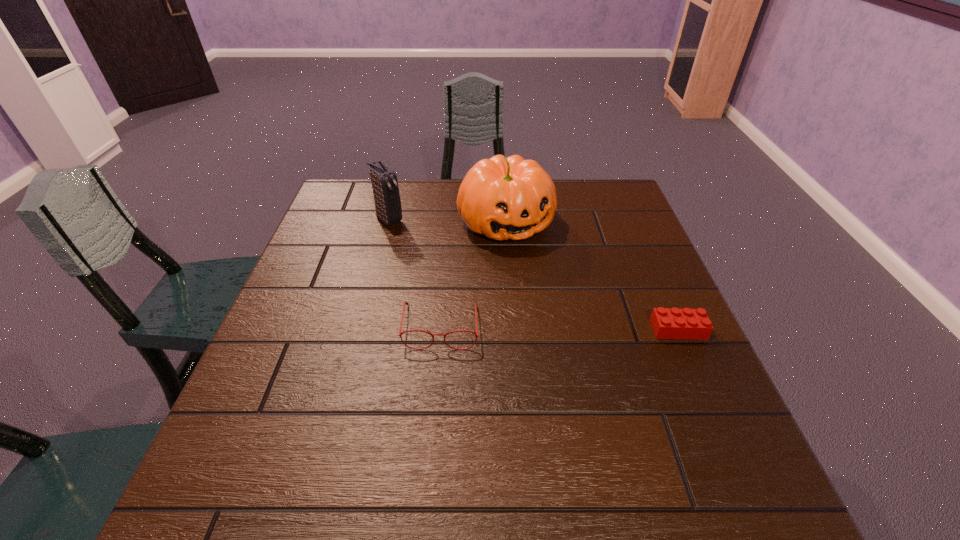
Find the location of a particular element. The width and height of the screenshot is (960, 540). spectacles is located at coordinates coord(405,303).

This screenshot has width=960, height=540. Identify the location of the rightmost object. (667, 323).

At what (x,y) coordinates should I click in order to perform the action: click on the shortest object. Please return your answer as a coordinate pair (x, y). Image resolution: width=960 pixels, height=540 pixels. Looking at the image, I should click on (667, 323).

The width and height of the screenshot is (960, 540). Identify the location of the leftmost object. (387, 201).

This screenshot has height=540, width=960. Identify the location of pumpkin. pos(502,198).

I want to click on free space located on the face of the third tallest object, so click(x=435, y=400).

The width and height of the screenshot is (960, 540). Find the location of `free space located on the left of the rightmost object`. free space located on the left of the rightmost object is located at coordinates (593, 329).

Find the location of `free space located 0.360m with the zip open on the clutch bag`. free space located 0.360m with the zip open on the clutch bag is located at coordinates (480, 291).

Where is `blank area located 0.260m with the zip open on the clutch bag`? Image resolution: width=960 pixels, height=540 pixels. blank area located 0.260m with the zip open on the clutch bag is located at coordinates (454, 271).

Where is `free spot located 0.260m with the zip open on the clutch bag`? The height and width of the screenshot is (540, 960). free spot located 0.260m with the zip open on the clutch bag is located at coordinates point(454,271).